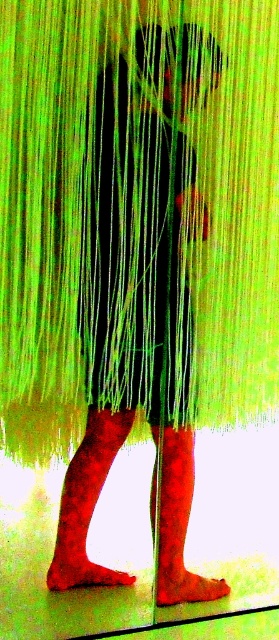
Based on the photo, you are a photographer setting up a shoot in this scene. You need to position a light source to the right of both the green string curtain at center and the matte red sock at lower center. Is this possible given their current positions?

The green string curtain at center is to the left of matte red sock at lower center. Since the curtain is already positioned to the left of the sock, you can place the light source to the right of both objects by positioning it beyond the sock on the right side of the scene.

You are a photographer setting up a shoot. You want to ensure the velvet red sock at lower left is in focus while the background remains slightly blurred. Given the sock is 4.19 feet away from you, what should your camera focus distance be set to?

The velvet red sock at lower left is 4.19 feet from the viewer, so the camera focus distance should be set to 4.19 feet to ensure the sock is in focus while the background stays blurred.

You are a delivery robot trying to navigate through the space between the green string curtain at center and the velvet red sock at lower left. Your robot has a width of 10 inches. Can you fit through the space between them?

The green string curtain at center is 11.54 inches away from the velvet red sock at lower left. Since your robot is 10 inches wide, you can fit through the space between them as the distance is greater than your width.